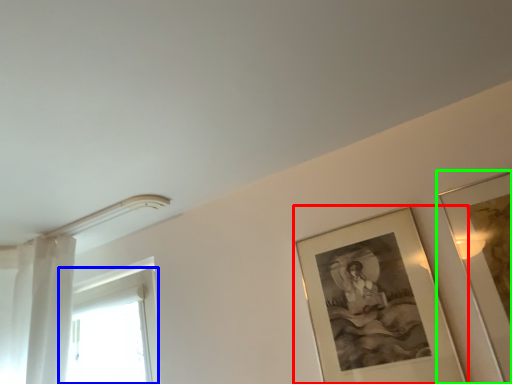
Question: Which object is the farthest from picture frame (highlighted by a red box)? Choose among these: window (highlighted by a blue box) or picture frame (highlighted by a green box).

Choices:
 (A) window
 (B) picture frame

Answer: (A)